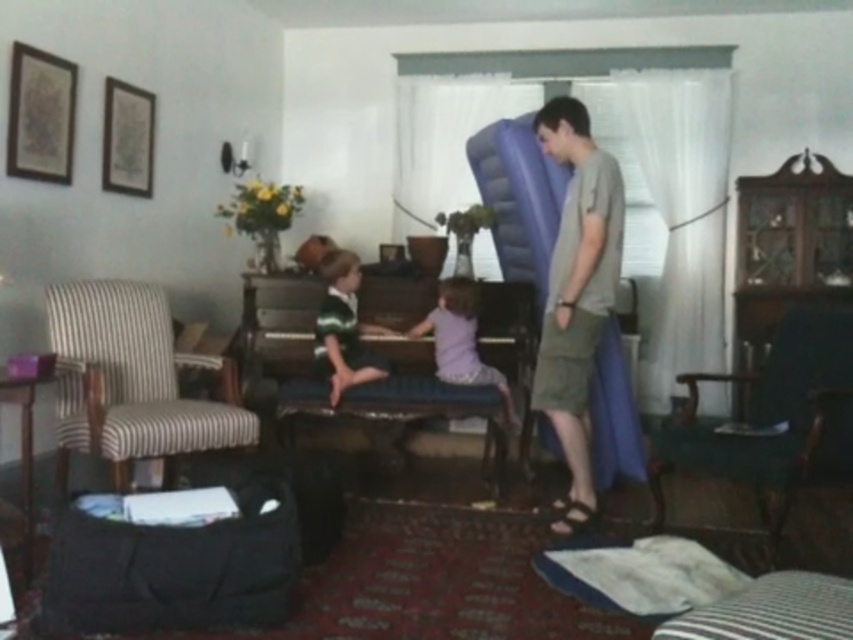
You are standing in the living room and want to place a small plant between the two points marked as point (x=352, y=380) and point (x=436, y=372). Which point should the plant be closer to if you want it to be nearer to the piano?

The plant should be placed closer to point (x=352, y=380) because it is closer to the viewer, which would place it nearer to the piano located in the center of the room.